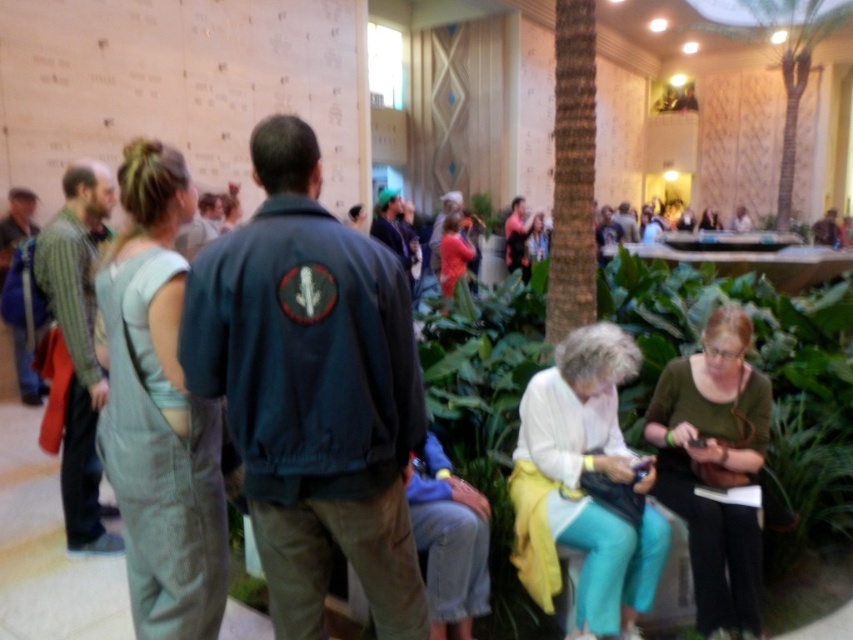
Who is more forward, (683, 468) or (460, 224)?

Point (683, 468)

Consider the image. Can you confirm if green fabric purse at lower right is taller than matte pink shirt at center?

Yes, green fabric purse at lower right is taller than matte pink shirt at center.

Image resolution: width=853 pixels, height=640 pixels. Describe the element at coordinates (714, 467) in the screenshot. I see `green fabric purse at lower right` at that location.

Image resolution: width=853 pixels, height=640 pixels. Identify the location of green fabric purse at lower right. (714, 467).

Is light blue denim overalls at left further to camera compared to white matte sweater at center?

No, light blue denim overalls at left is in front of white matte sweater at center.

Which is in front, point (155, 497) or point (546, 516)?

Point (155, 497)

Image resolution: width=853 pixels, height=640 pixels. Describe the element at coordinates (160, 412) in the screenshot. I see `light blue denim overalls at left` at that location.

Where is `light blue denim overalls at left`? The image size is (853, 640). light blue denim overalls at left is located at coordinates (160, 412).

Is white matte sweater at center wider than green fabric purse at lower right?

Yes, white matte sweater at center is wider than green fabric purse at lower right.

Is white matte sweater at center further to the viewer compared to green fabric purse at lower right?

No, white matte sweater at center is closer to the viewer.

In order to click on white matte sweater at center in this screenshot , I will do `click(579, 486)`.